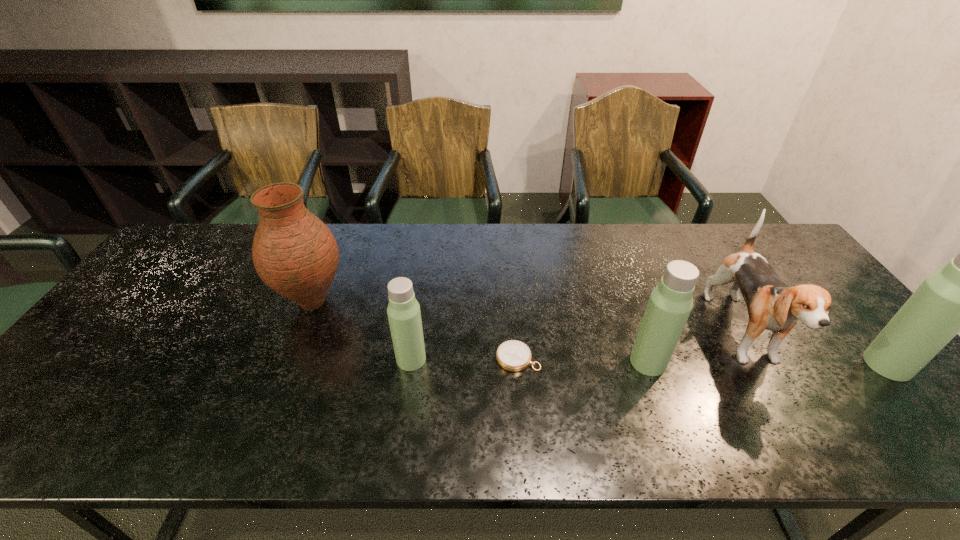
Image resolution: width=960 pixels, height=540 pixels. Find the location of `vacant space at the near edge of the desktop`. vacant space at the near edge of the desktop is located at coordinates (841, 406).

In the image, there is a desktop. Where is `vacant area at the left edge`? vacant area at the left edge is located at coordinates (137, 293).

In the image, there is a desktop. Identify the location of vacant space at the right edge. (839, 359).

Find the location of `vacant region at the far left corner of the desktop`. vacant region at the far left corner of the desktop is located at coordinates (179, 256).

Where is `free spot between the fifth object from left to right and the leftmost thermos bottle`? The height and width of the screenshot is (540, 960). free spot between the fifth object from left to right and the leftmost thermos bottle is located at coordinates (578, 348).

Find the location of a particular element. This screenshot has width=960, height=540. vacant area that lies between the compass and the rightmost thermos bottle is located at coordinates (703, 361).

I want to click on unoccupied area between the rightmost object and the compass, so click(703, 361).

The height and width of the screenshot is (540, 960). Identify the location of free space between the puppy and the leftmost thermos bottle. (578, 348).

Identify the location of free space that is in between the puppy and the compass. This screenshot has height=540, width=960. (631, 347).

You are a GUI agent. You are given a task and a screenshot of the screen. Output one action in this format:
    pyautogui.click(x=<x>, y=<y>)
    Task: Click on the vacant space in between the shortest object and the rightmost object
    Image resolution: width=960 pixels, height=540 pixels.
    Given the screenshot: What is the action you would take?
    pyautogui.click(x=703, y=361)